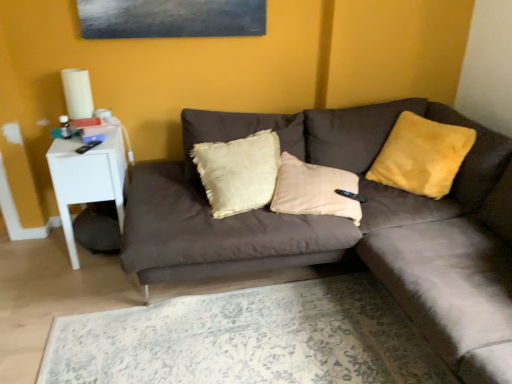
Locate an element on the screen. The width and height of the screenshot is (512, 384). blank area to the left of white glossy side table at left is located at coordinates (32, 254).